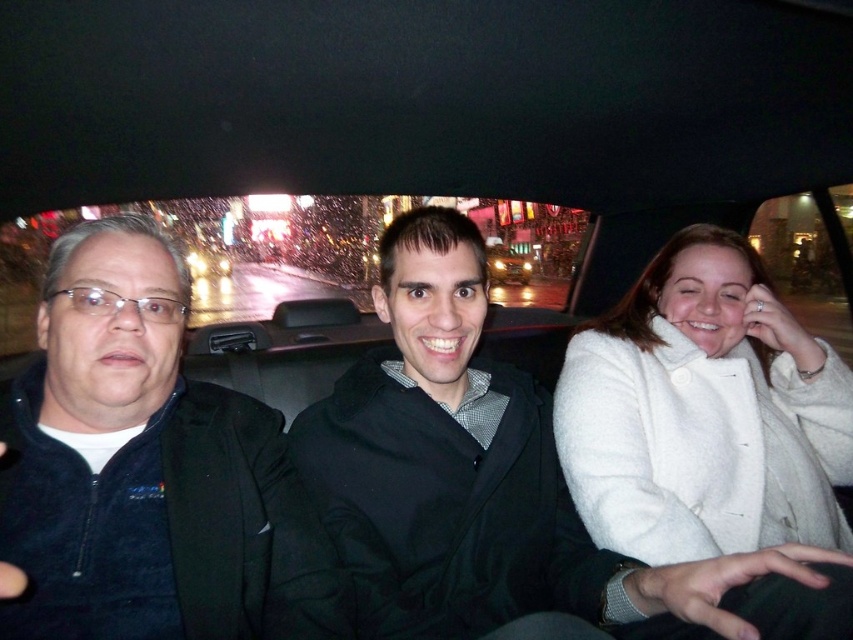
Question: Estimate the real-world distances between objects in this image. Which object is farther from the dark blue fleece jacket at left?

Choices:
 (A) white wool coat at right
 (B) matte black jacket at center

Answer: (A)

Question: Can you confirm if dark blue fleece jacket at left is positioned to the left of white wool coat at right?

Choices:
 (A) yes
 (B) no

Answer: (A)

Question: Estimate the real-world distances between objects in this image. Which object is farther from the white wool coat at right?

Choices:
 (A) matte black jacket at center
 (B) dark blue fleece jacket at left

Answer: (B)

Question: Can you confirm if matte black jacket at center is wider than white wool coat at right?

Choices:
 (A) no
 (B) yes

Answer: (B)

Question: Which object is positioned closest to the white wool coat at right?

Choices:
 (A) matte black jacket at center
 (B) dark blue fleece jacket at left

Answer: (A)

Question: Where is matte black jacket at center located in relation to dark blue fleece jacket at left in the image?

Choices:
 (A) above
 (B) below

Answer: (B)